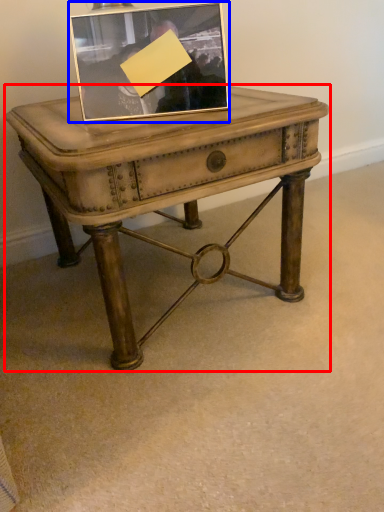
Question: Which object appears closest to the camera in this image, table (highlighted by a red box) or picture frame (highlighted by a blue box)?

Choices:
 (A) table
 (B) picture frame

Answer: (A)